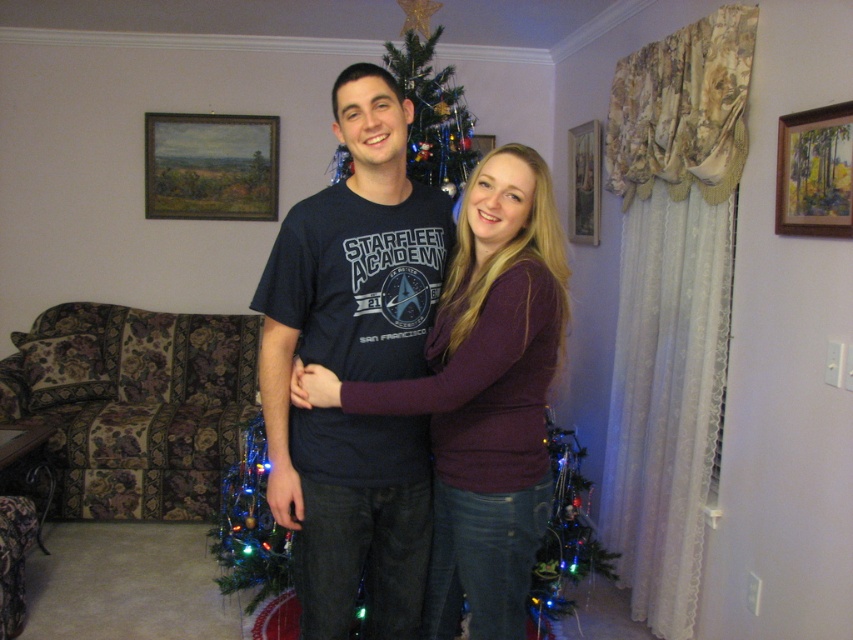
Question: Based on their relative distances, which object is nearer to the shiny metallic tree at center?

Choices:
 (A) wooden framed painting at upper right
 (B) dark blue t-shirt at center
 (C) green matte christmas tree at lower right
 (D) wooden picture frame at upper right

Answer: (B)

Question: Which of the following is the farthest from the observer?

Choices:
 (A) (498, 630)
 (B) (601, 554)
 (C) (473, 148)

Answer: (C)

Question: From the image, what is the correct spatial relationship of maroon sweater at center in relation to shiny metallic tree at center?

Choices:
 (A) left
 (B) right

Answer: (B)

Question: Which point is closer to the camera?

Choices:
 (A) green matte christmas tree at lower right
 (B) shiny metallic tree at center
 (C) dark blue t-shirt at center

Answer: (C)

Question: Is dark blue t-shirt at center further to the viewer compared to wooden framed painting at upper left?

Choices:
 (A) no
 (B) yes

Answer: (A)

Question: Considering the relative positions of maroon sweater at center and wooden picture frame at upper center in the image provided, where is maroon sweater at center located with respect to wooden picture frame at upper center?

Choices:
 (A) below
 (B) above

Answer: (A)